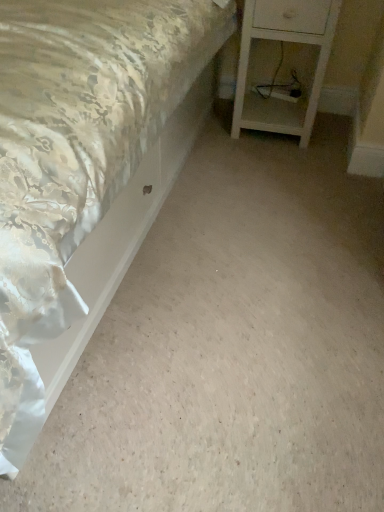
The height and width of the screenshot is (512, 384). What are the coordinates of `free region on the left part of white wood nightstand at lower right` in the screenshot? It's located at (214, 139).